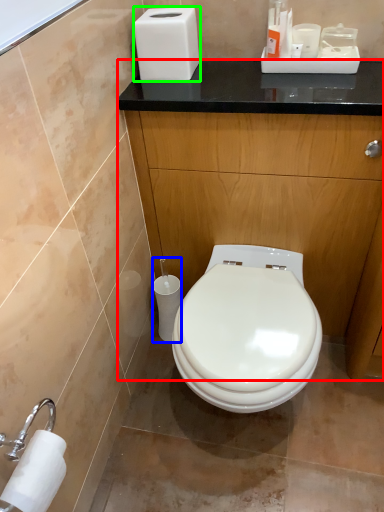
Question: Which is nearer to the dresser (highlighted by a red box)? toilet paper (highlighted by a blue box) or hand dryer (highlighted by a green box).

Choices:
 (A) toilet paper
 (B) hand dryer

Answer: (B)